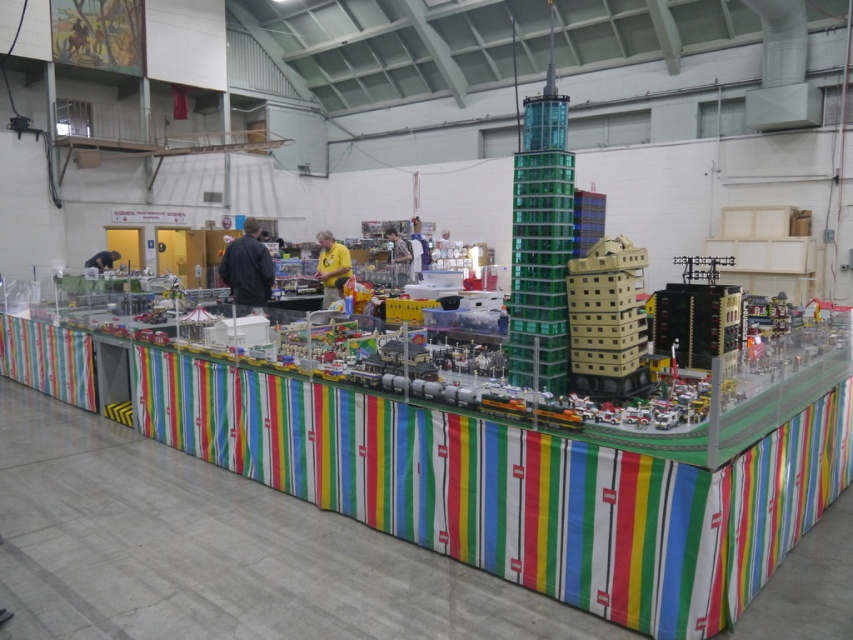
Question: Does transparent green glass tower at center have a smaller size compared to beige plastic building at center?

Choices:
 (A) yes
 (B) no

Answer: (A)

Question: Which of the following is the closest to the observer?

Choices:
 (A) transparent green glass tower at center
 (B) beige plastic building at center

Answer: (B)

Question: Which of the following is the closest to the observer?

Choices:
 (A) (541, 211)
 (B) (589, 392)

Answer: (B)

Question: Can you confirm if transparent green glass tower at center is wider than beige plastic building at center?

Choices:
 (A) no
 (B) yes

Answer: (A)

Question: Can you confirm if transparent green glass tower at center is wider than beige plastic building at center?

Choices:
 (A) no
 (B) yes

Answer: (A)